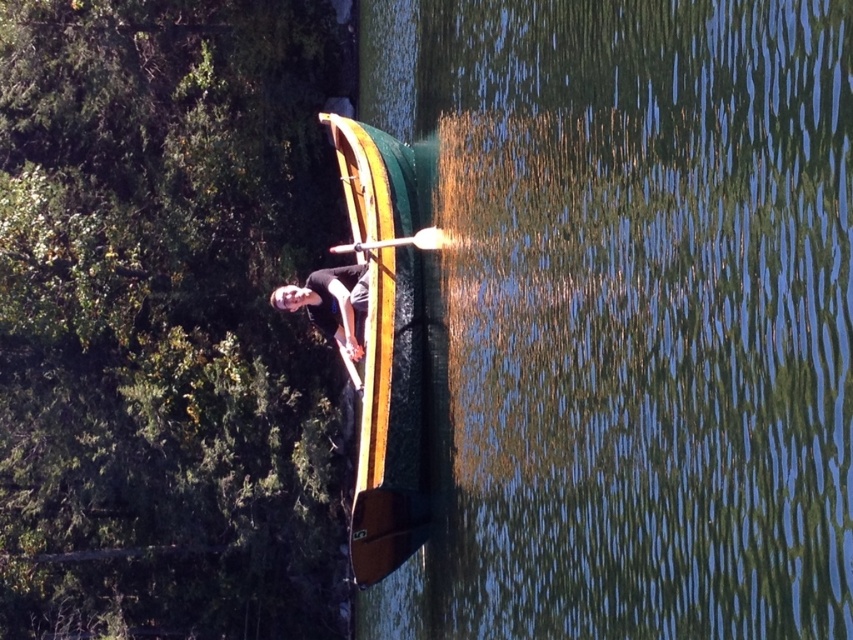
You are an observer standing on the shore of the lake. You see the wooden paddle at center and the green leafy tree at upper left. Which object is closer to you?

The green leafy tree at upper left is closer to you because the wooden paddle at center is behind it.

You are a photographer trying to capture the entire green polished wood boat at center and the matte black shirt at center in one frame. Since the boat is larger, which object should you position closer to the camera to ensure both fit in the frame?

The green polished wood boat at center is larger than the matte black shirt at center. To ensure both fit in the frame, you should position the smaller matte black shirt at center closer to the camera while keeping the larger boat further back.